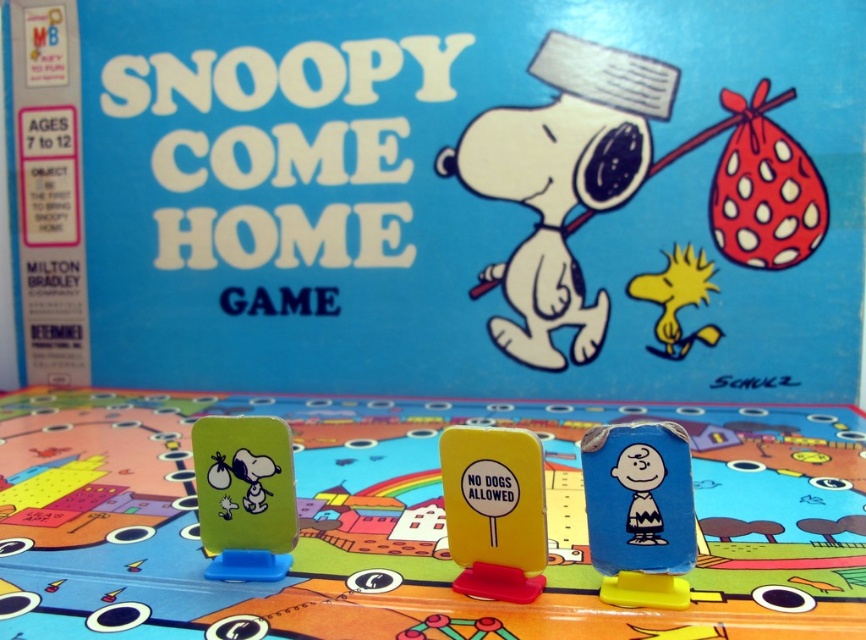
Question: From the image, what is the correct spatial relationship of matte plastic snoopy figure at center in relation to green matte plastic snoopy at left?

Choices:
 (A) above
 (B) below

Answer: (A)

Question: Which point appears closest to the camera in this image?

Choices:
 (A) tap(509, 420)
 (B) tap(525, 513)
 (C) tap(686, 460)
 (D) tap(519, 140)

Answer: (C)

Question: Is matte green card at center to the left of yellow plastic sign at center from the viewer's perspective?

Choices:
 (A) yes
 (B) no

Answer: (A)

Question: Which of the following is the farthest from the observer?

Choices:
 (A) (622, 454)
 (B) (234, 365)
 (C) (585, 577)

Answer: (B)

Question: Among these objects, which one is nearest to the camera?

Choices:
 (A) matte plastic snoopy figure at center
 (B) green matte plastic snoopy at left

Answer: (A)

Question: Does matte plastic snoopy figure at center lie in front of blue matte charlie brown figure at center?

Choices:
 (A) yes
 (B) no

Answer: (A)